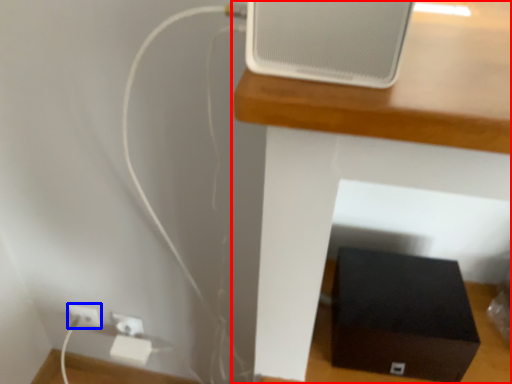
Question: Which object appears farthest to the camera in this image, furniture (highlighted by a red box) or electric outlet (highlighted by a blue box)?

Choices:
 (A) furniture
 (B) electric outlet

Answer: (B)